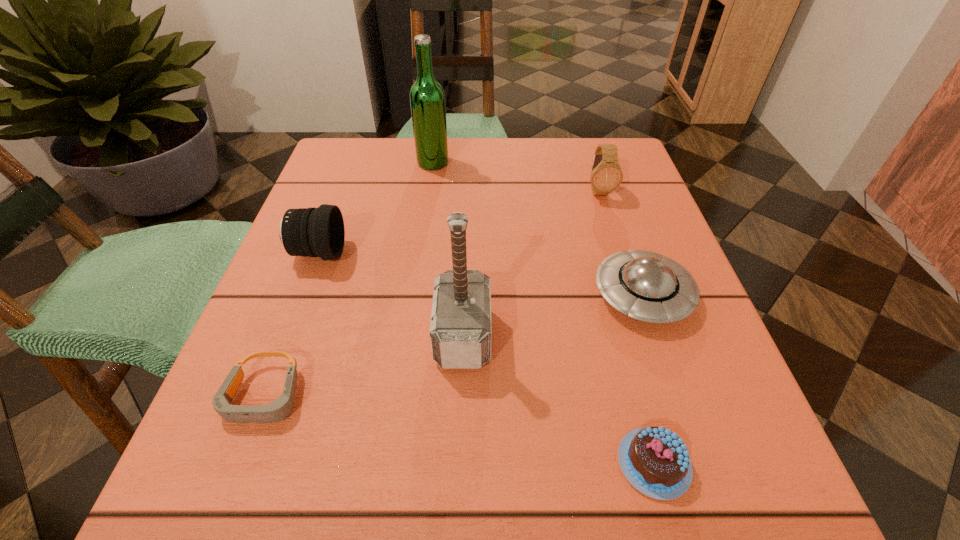
Identify the location of free location at the far left corner of the desktop. (364, 144).

The width and height of the screenshot is (960, 540). What are the coordinates of `vacant area at the far right corner` in the screenshot? It's located at (572, 146).

You are a GUI agent. You are given a task and a screenshot of the screen. Output one action in this format:
    pyautogui.click(x=<x>, y=<y>)
    Task: Click on the free region at the near right corner of the desktop
    The height and width of the screenshot is (540, 960).
    Given the screenshot: What is the action you would take?
    pyautogui.click(x=733, y=485)

Identify the location of free spot between the farthest object and the chocolate cake. The height and width of the screenshot is (540, 960). (543, 313).

Image resolution: width=960 pixels, height=540 pixels. Find the location of `vacant area that lies between the chocolate cake and the farthest object`. vacant area that lies between the chocolate cake and the farthest object is located at coordinates (543, 313).

Image resolution: width=960 pixels, height=540 pixels. Find the location of `free space between the chocolate cake and the farthest object`. free space between the chocolate cake and the farthest object is located at coordinates (543, 313).

Find the location of a particular element. The width and height of the screenshot is (960, 540). vacant space that is in between the chocolate cake and the saucer is located at coordinates (648, 379).

I want to click on unoccupied position between the second farthest object and the chocolate cake, so pyautogui.click(x=626, y=327).

Find the location of a particular element. Image resolution: width=960 pixels, height=540 pixels. vacant space that's between the telephoto lens and the hammer is located at coordinates (391, 294).

Where is `vacant space that is in between the shortest object and the telephoto lens`? The width and height of the screenshot is (960, 540). vacant space that is in between the shortest object and the telephoto lens is located at coordinates (291, 325).